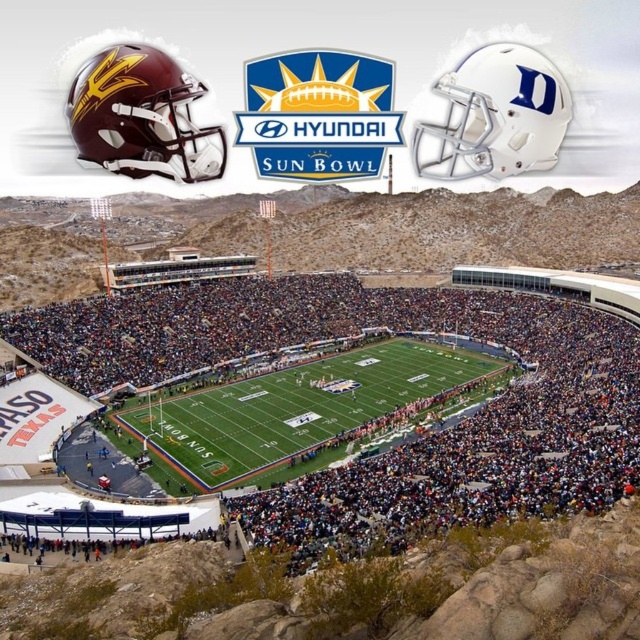
Question: Is matte green turf at center behind maroon matte helmet at upper left?

Choices:
 (A) no
 (B) yes

Answer: (A)

Question: Among these objects, which one is nearest to the camera?

Choices:
 (A) green turf football field at center
 (B) maroon matte helmet at upper left
 (C) white matte helmet at upper right
 (D) matte green turf at center

Answer: (D)

Question: Estimate the real-world distances between objects in this image. Which object is farther from the white matte helmet at upper right?

Choices:
 (A) maroon matte helmet at upper left
 (B) matte green turf at center

Answer: (B)

Question: Can you confirm if green turf football field at center is wider than maroon matte helmet at upper left?

Choices:
 (A) no
 (B) yes

Answer: (B)

Question: Among these points, which one is farthest from the camera?

Choices:
 (A) (305, 440)
 (B) (125, 108)

Answer: (A)

Question: Considering the relative positions of matte green turf at center and green turf football field at center in the image provided, where is matte green turf at center located with respect to green turf football field at center?

Choices:
 (A) left
 (B) right

Answer: (A)